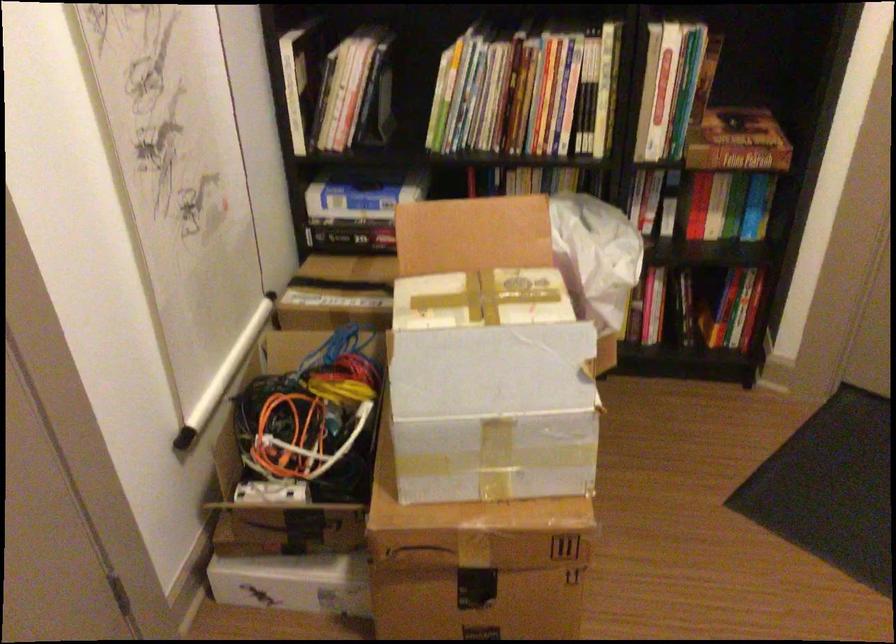
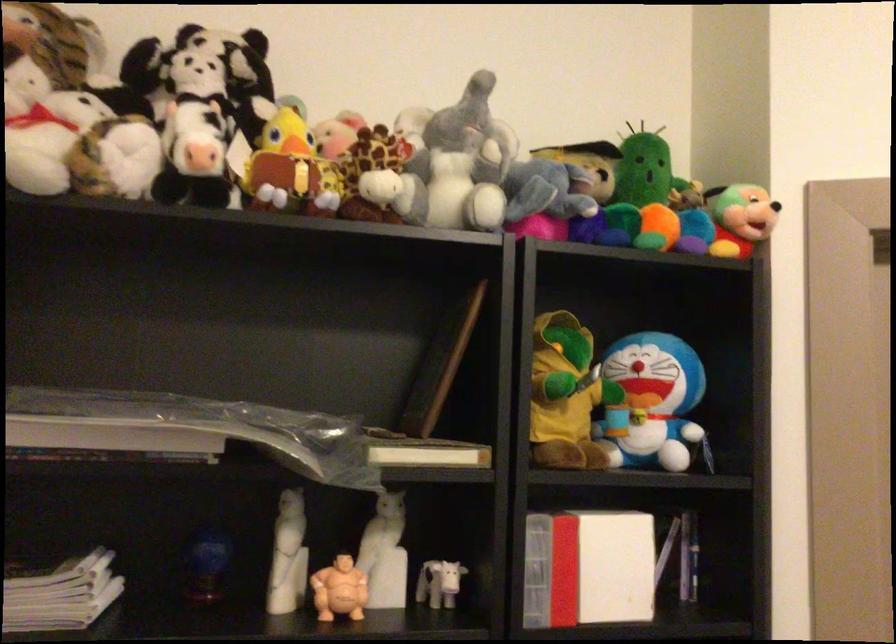
The first image is from the beginning of the video and the second image is from the end. How did the camera likely rotate when shooting the video?

The camera rotated toward right-up.